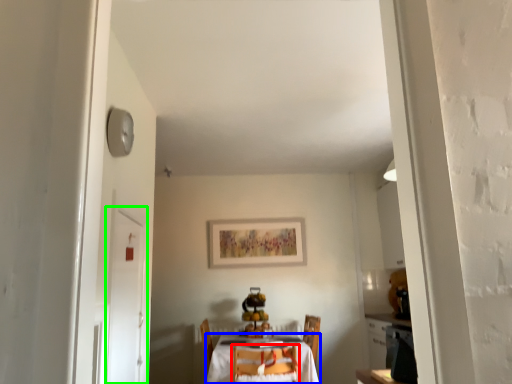
Question: Based on their relative distances, which object is nearer to chair (highlighted by a red box)? Choose from table (highlighted by a blue box) and door (highlighted by a green box).

Choices:
 (A) table
 (B) door

Answer: (A)